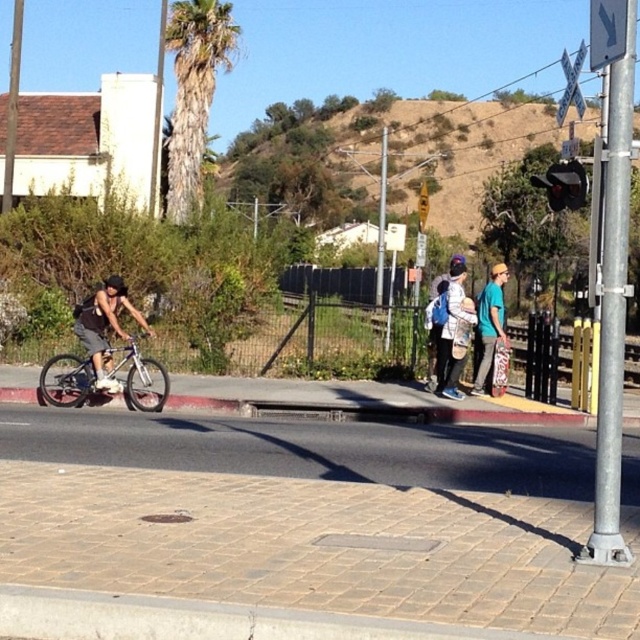
Does silver metallic bicycle at left have a lesser width compared to brushed metal arrow at upper right?

Yes.

Between point (84, 380) and point (611, 6), which one is positioned in front?

Positioned in front is point (611, 6).

I want to click on silver metallic bicycle at left, so point(67,380).

Who is positioned more to the right, matte blue backpack at center or teal fabric hoodie at center?

From the viewer's perspective, teal fabric hoodie at center appears more on the right side.

The height and width of the screenshot is (640, 640). I want to click on matte blue backpack at center, so click(454, 333).

Find the location of `matte blue backpack at center`. matte blue backpack at center is located at coordinates (454, 333).

Which is more to the left, matte blue backpack at center or brushed metal railroad crossing sign at upper right?

matte blue backpack at center

Is point (442, 332) positioned before point (572, 76)?

Yes, point (442, 332) is in front of point (572, 76).

The image size is (640, 640). Identify the location of matte blue backpack at center. (454, 333).